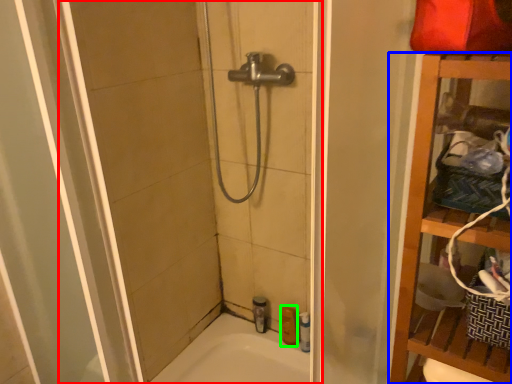
Question: Estimate the real-world distances between objects in this image. Which object is farther from shower door (highlighted by a red box), furniture (highlighted by a blue box) or toiletry (highlighted by a green box)?

Choices:
 (A) furniture
 (B) toiletry

Answer: (A)